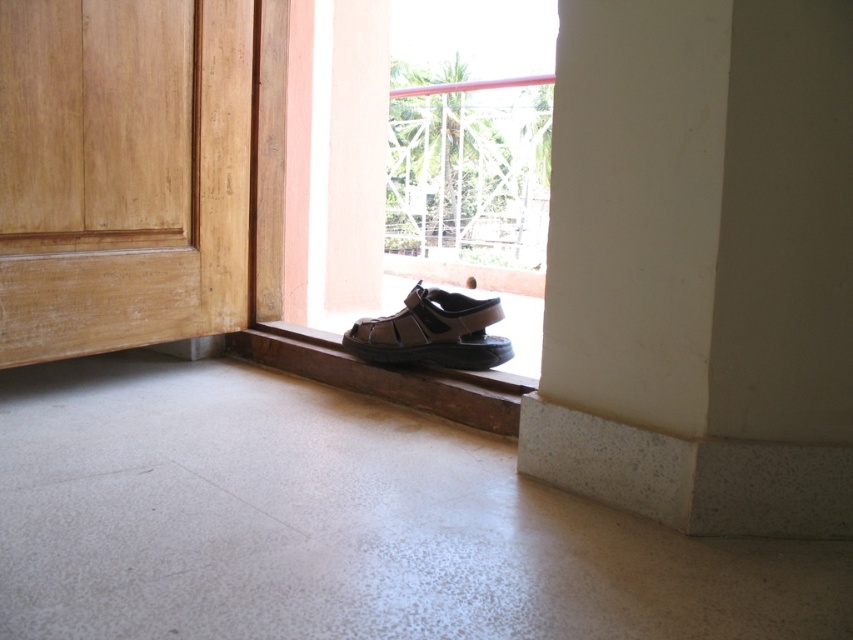
Question: Does white textured pillar at lower right appear on the right side of light brown wood door at lower left?

Choices:
 (A) yes
 (B) no

Answer: (A)

Question: Is light brown wood door at lower left bigger than brown leather sandal at lower center?

Choices:
 (A) no
 (B) yes

Answer: (B)

Question: Does white textured pillar at lower right lie in front of brown leather sandal at lower center?

Choices:
 (A) yes
 (B) no

Answer: (A)

Question: Which point appears farthest from the camera in this image?

Choices:
 (A) (100, 289)
 (B) (409, 321)

Answer: (A)

Question: Estimate the real-world distances between objects in this image. Which object is closer to the light brown wood door at lower left?

Choices:
 (A) white textured pillar at lower right
 (B) brown leather sandal at lower center

Answer: (B)

Question: Which of these objects is positioned farthest from the light brown wood door at lower left?

Choices:
 (A) brown leather sandal at lower center
 (B) white textured pillar at lower right

Answer: (B)